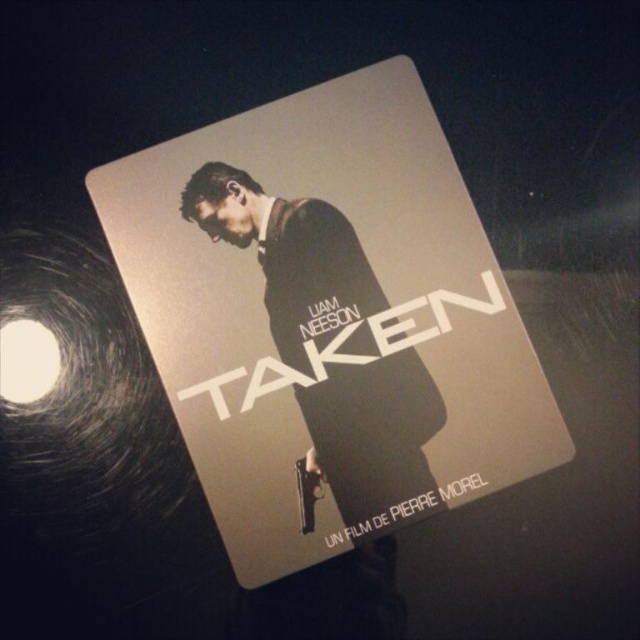
Question: Is metallic silver book at center further to the viewer compared to matte black suit at center?

Choices:
 (A) no
 (B) yes

Answer: (A)

Question: Which of the following is the farthest from the observer?

Choices:
 (A) matte black suit at center
 (B) metallic silver book at center

Answer: (A)

Question: Is metallic silver book at center closer to camera compared to matte black suit at center?

Choices:
 (A) yes
 (B) no

Answer: (A)

Question: Considering the relative positions of metallic silver book at center and matte black suit at center in the image provided, where is metallic silver book at center located with respect to matte black suit at center?

Choices:
 (A) above
 (B) below

Answer: (A)

Question: Which point appears farthest from the camera in this image?

Choices:
 (A) (454, 280)
 (B) (320, 298)

Answer: (B)